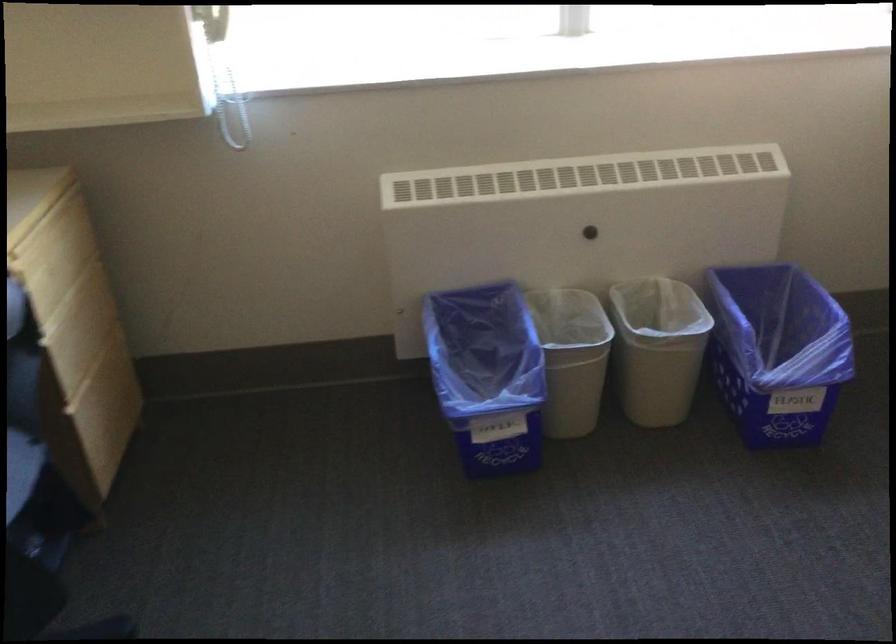
This screenshot has width=896, height=644. What are the coordinates of `black heater knob` in the screenshot? It's located at (590, 232).